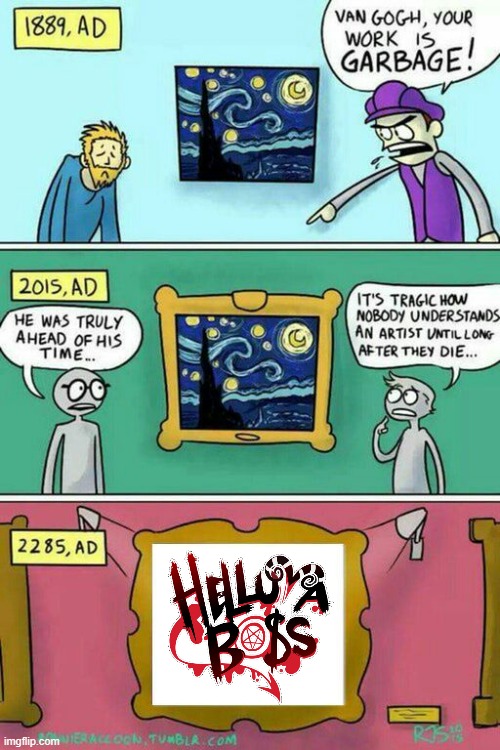
Locate an element on the screen. The height and width of the screenshot is (750, 500). red wall is located at coordinates (421, 632).